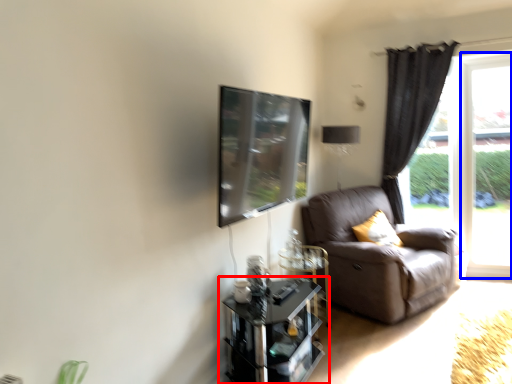
Question: Which point is closer to the camera, table (highlighted by a red box) or window frame (highlighted by a blue box)?

Choices:
 (A) table
 (B) window frame

Answer: (A)